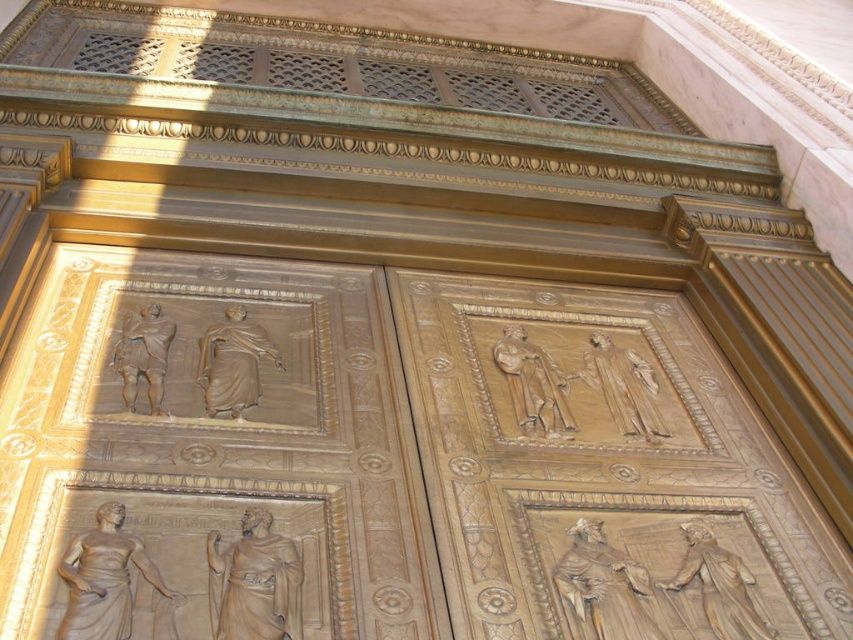
You are an architect examining the grand building facade. You need to locate the matte bronze statue at lower left. What are the coordinates where you can find it?

The matte bronze statue at lower left can be found at coordinates point (x=105, y=579).

You are an art conservator examining the architectural detail. You need to assess the positioning of the matte bronze statue at lower left and the golden bronze statue at center. Which statue is positioned lower in the scene?

The matte bronze statue at lower left is positioned below the golden bronze statue at center, so it is lower in the scene.